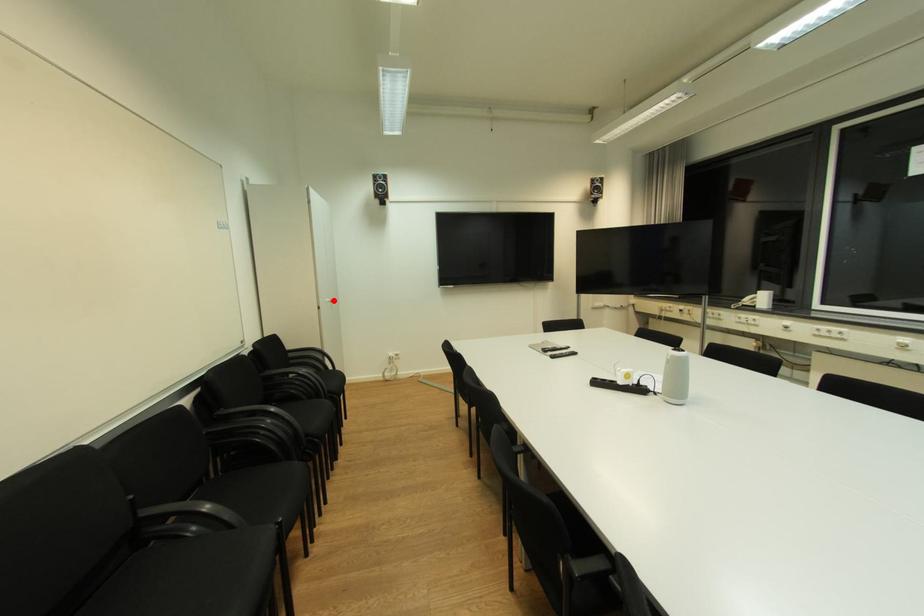
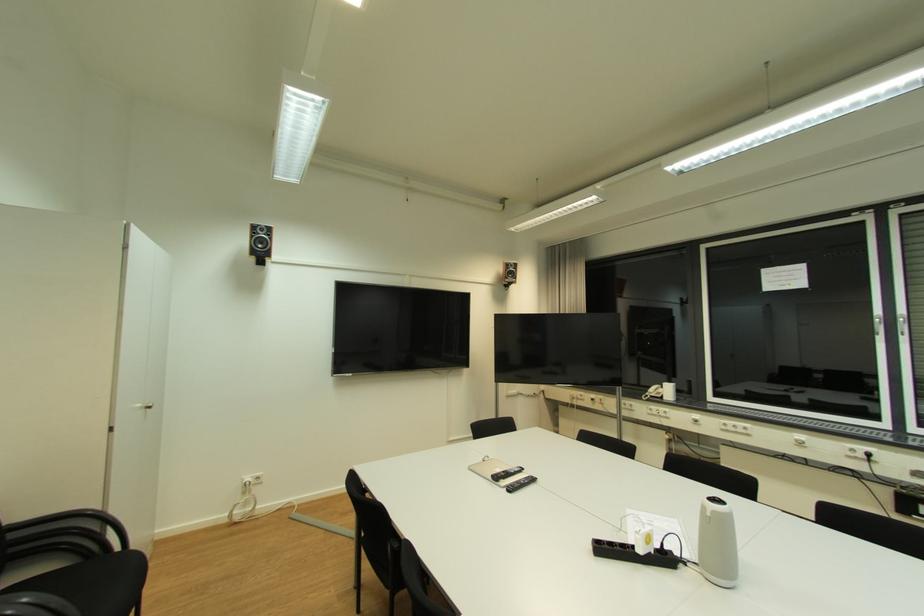
Where in the second image is the point corresponding to the highlighted location from the first image?

(146, 407)